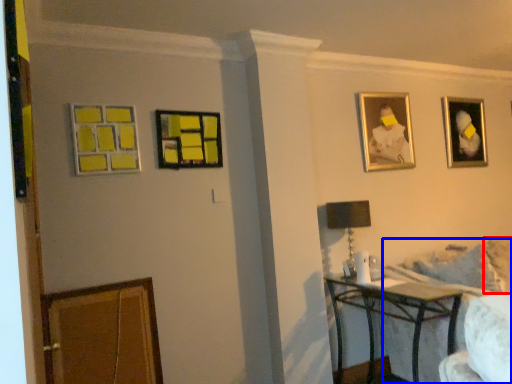
Question: Which object is closer to the camera taking this photo, pillow (highlighted by a red box) or couch (highlighted by a blue box)?

Choices:
 (A) pillow
 (B) couch

Answer: (B)